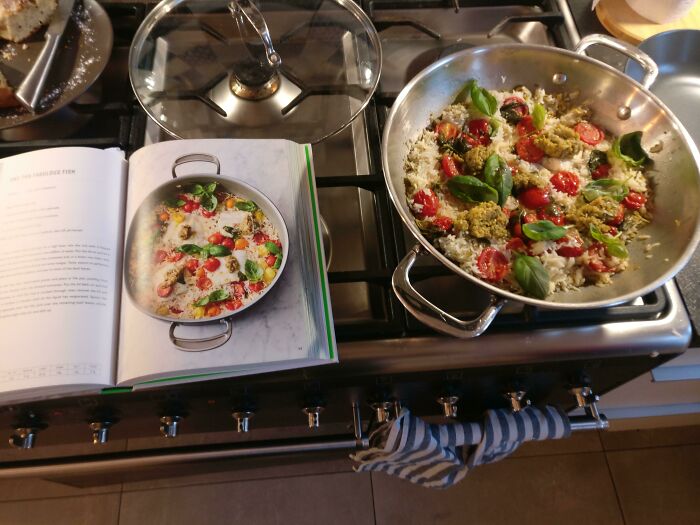
This screenshot has height=525, width=700. I want to click on handle, so click(x=421, y=310), click(x=626, y=48).